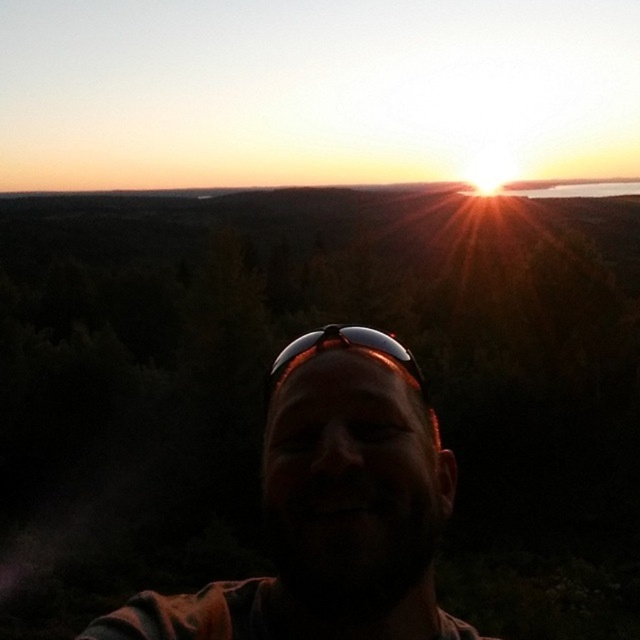
You are trying to decide which pair of sunglasses to take with you for your hike. You see both the matte black sunglasses at center and the black reflective sunglasses at center. Which one is located to the left of the other?

The matte black sunglasses at center is positioned on the left side of black reflective sunglasses at center.